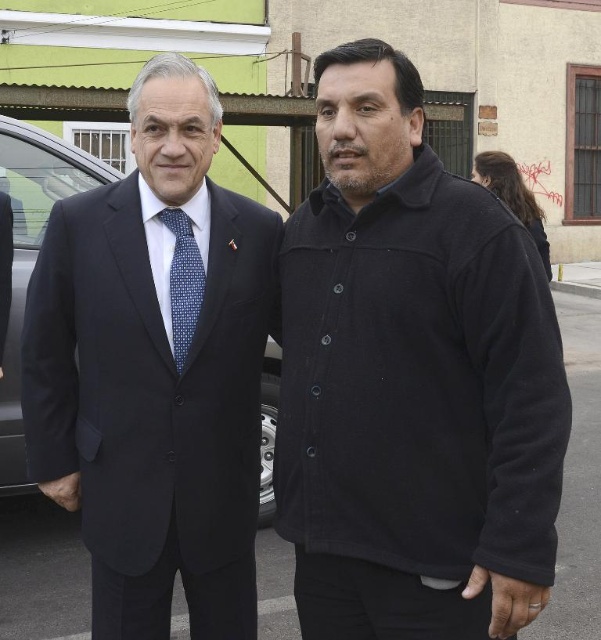
Is point (29, 198) more distant than point (177, 365)?

Yes.

Does dark blue fabric car at left have a greater width compared to blue dotted tie at center?

Indeed, dark blue fabric car at left has a greater width compared to blue dotted tie at center.

Which is in front, point (13, 416) or point (198, 268)?

Point (198, 268) is more forward.

What are the coordinates of `dark blue fabric car at left` in the screenshot? It's located at (31, 256).

Can you confirm if black fleece jacket at center is thinner than matte black suit at left?

Yes.

Which is above, black fleece jacket at center or matte black suit at left?

black fleece jacket at center

Is point (462, 186) closer to viewer compared to point (50, 262)?

Yes, it is.

Identify the location of black fleece jacket at center. This screenshot has width=601, height=640. (412, 381).

Between black fleece jacket at center and dark blue fabric car at left, which one appears on the right side from the viewer's perspective?

black fleece jacket at center is more to the right.

Which is in front, point (319, 58) or point (10, 333)?

Point (319, 58)

The width and height of the screenshot is (601, 640). In order to click on black fleece jacket at center in this screenshot , I will do `click(412, 381)`.